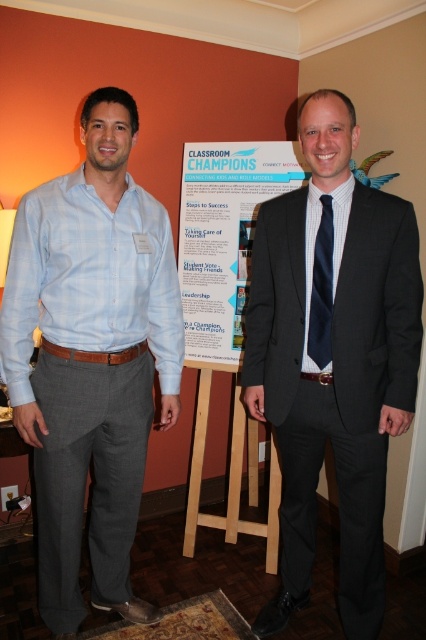
Question: Observing the image, what is the correct spatial positioning of light blue plaid shirt at center in reference to matte black suit at center?

Choices:
 (A) left
 (B) right

Answer: (A)

Question: Is light blue plaid shirt at center further to the viewer compared to white paper poster at center?

Choices:
 (A) yes
 (B) no

Answer: (B)

Question: Which point is farther to the camera?

Choices:
 (A) (322, 248)
 (B) (239, 285)
 (C) (80, 595)

Answer: (B)

Question: Which of these objects is positioned closest to the matte black suit at center?

Choices:
 (A) white paper poster at center
 (B) navy blue silk tie at center

Answer: (B)

Question: Which of the following is the farthest from the observer?

Choices:
 (A) navy blue silk tie at center
 (B) white paper poster at center
 (C) matte black suit at center

Answer: (B)

Question: In this image, where is light blue plaid shirt at center located relative to matte black suit at center?

Choices:
 (A) above
 (B) below

Answer: (B)